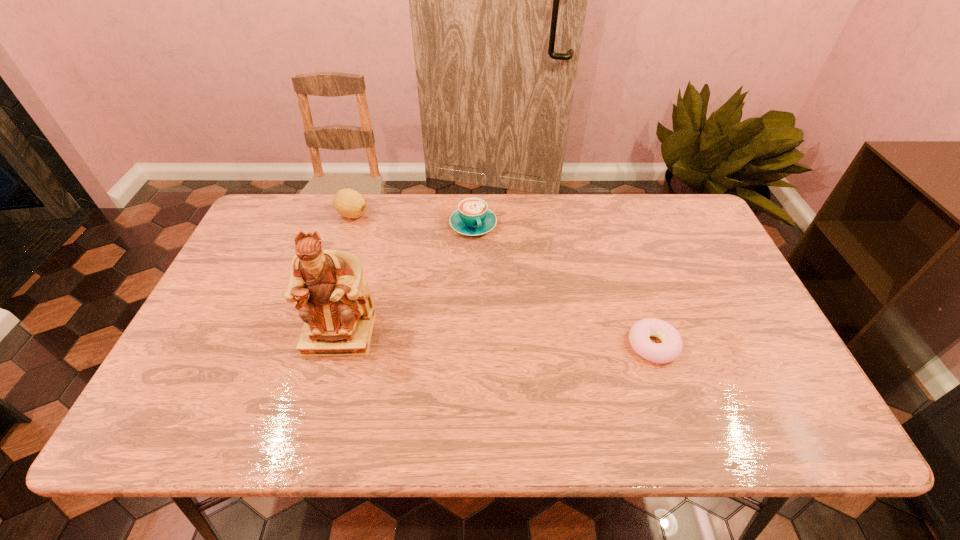
The image size is (960, 540). What are the coordinates of `vacant spot on the desktop that is between the tallest object and the doughnut and is positioned with the handle on the right side of the second shortest object` in the screenshot? It's located at (528, 341).

Identify the location of free space on the desktop that is between the figurine and the doughnut and is positioned at the stem end of the lemon. (449, 338).